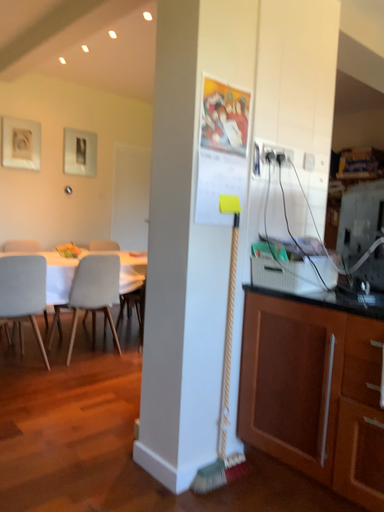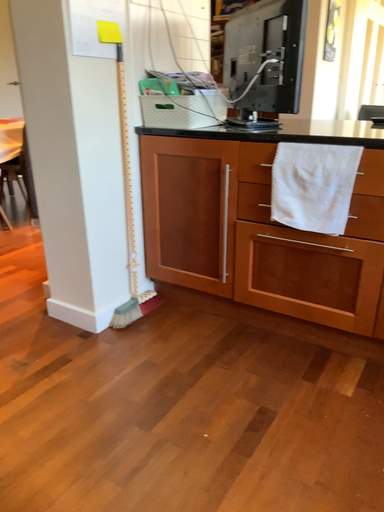
Question: Which way did the camera rotate in the video?

Choices:
 (A) rotated upward
 (B) rotated downward

Answer: (B)